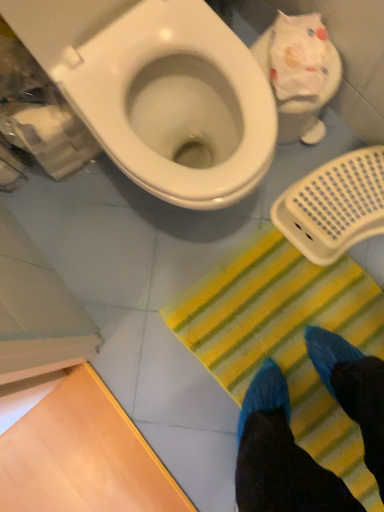
What do you see at coordinates (299, 73) in the screenshot? I see `white plastic toilet at upper right, which is counted as the second toilet, starting from the left` at bounding box center [299, 73].

At what (x,y) coordinates should I click in order to perform the action: click on yellow striped mat at lower center. Please return your answer as a coordinate pair (x, y). The width and height of the screenshot is (384, 512). Looking at the image, I should click on click(x=279, y=324).

Describe the element at coordinates (279, 324) in the screenshot. The image size is (384, 512). I see `yellow striped mat at lower center` at that location.

At what (x,y) coordinates should I click in order to perform the action: click on white plastic toilet at upper right, positioned as the first toilet in right-to-left order. Please return your answer as a coordinate pair (x, y). This screenshot has width=384, height=512. Looking at the image, I should click on (299, 73).

Considering the relative sizes of white plastic toilet at upper right, positioned as the first toilet in right-to-left order, and white glossy toilet at upper left, the first toilet viewed from the left, in the image provided, is white plastic toilet at upper right, positioned as the first toilet in right-to-left order, wider than white glossy toilet at upper left, the first toilet viewed from the left,?

In fact, white plastic toilet at upper right, positioned as the first toilet in right-to-left order, might be narrower than white glossy toilet at upper left, the first toilet viewed from the left.

Does white plastic toilet at upper right, which is counted as the second toilet, starting from the left, turn towards white glossy toilet at upper left, the 2th toilet from the right?

No.

Between white plastic toilet at upper right, which is counted as the second toilet, starting from the left, and white glossy toilet at upper left, the first toilet viewed from the left, which one has less height?

white plastic toilet at upper right, which is counted as the second toilet, starting from the left.

Does point (296, 26) come farther from viewer compared to point (170, 34)?

Yes, it is.

From a real-world perspective, is white glossy toilet at upper left, the first toilet viewed from the left, located higher than yellow striped mat at lower center?

Yes.

Considering the sizes of objects white glossy toilet at upper left, the first toilet viewed from the left, and yellow striped mat at lower center in the image provided, who is taller, white glossy toilet at upper left, the first toilet viewed from the left, or yellow striped mat at lower center?

Standing taller between the two is white glossy toilet at upper left, the first toilet viewed from the left.

Is white glossy toilet at upper left, the first toilet viewed from the left, placed right next to yellow striped mat at lower center?

No.

Is yellow striped mat at lower center positioned far away from white plastic toilet at upper right, positioned as the first toilet in right-to-left order?

No, yellow striped mat at lower center is not far from white plastic toilet at upper right, positioned as the first toilet in right-to-left order.

Can you confirm if yellow striped mat at lower center is thinner than white plastic toilet at upper right, which is counted as the second toilet, starting from the left?

A: Incorrect, the width of yellow striped mat at lower center is not less than that of white plastic toilet at upper right, which is counted as the second toilet, starting from the left.

Considering the positions of objects yellow striped mat at lower center and white plastic toilet at upper right, which is counted as the second toilet, starting from the left, in the image provided, who is more to the left, yellow striped mat at lower center or white plastic toilet at upper right, which is counted as the second toilet, starting from the left,?

white plastic toilet at upper right, which is counted as the second toilet, starting from the left.

Could you tell me if yellow striped mat at lower center is facing white plastic toilet at upper right, positioned as the first toilet in right-to-left order?

No, yellow striped mat at lower center is not aimed at white plastic toilet at upper right, positioned as the first toilet in right-to-left order.

Is white plastic toilet at upper right, positioned as the first toilet in right-to-left order, to the left or to the right of yellow striped mat at lower center in the image?

white plastic toilet at upper right, positioned as the first toilet in right-to-left order, is to the left of yellow striped mat at lower center.

Based on the photo, is white plastic toilet at upper right, positioned as the first toilet in right-to-left order, oriented away from yellow striped mat at lower center?

No, white plastic toilet at upper right, positioned as the first toilet in right-to-left order, is not facing the opposite direction of yellow striped mat at lower center.

Does point (282, 85) come closer to viewer compared to point (376, 305)?

Yes, it is in front of point (376, 305).

From the image's perspective, between white plastic toilet at upper right, positioned as the first toilet in right-to-left order, and yellow striped mat at lower center, who is located below?

yellow striped mat at lower center.

From the image's perspective, is white glossy toilet at upper left, the 2th toilet from the right, over white plastic toilet at upper right, which is counted as the second toilet, starting from the left?

No, from the image's perspective, white glossy toilet at upper left, the 2th toilet from the right, is not over white plastic toilet at upper right, which is counted as the second toilet, starting from the left.

Is point (145, 58) farther from camera compared to point (265, 61)?

No, it is in front of (265, 61).

Considering the relative sizes of white glossy toilet at upper left, the 2th toilet from the right, and white plastic toilet at upper right, positioned as the first toilet in right-to-left order, in the image provided, is white glossy toilet at upper left, the 2th toilet from the right, shorter than white plastic toilet at upper right, positioned as the first toilet in right-to-left order,?

No.

In terms of width, does yellow striped mat at lower center look wider or thinner when compared to white glossy toilet at upper left, the 2th toilet from the right?

Clearly, yellow striped mat at lower center has more width compared to white glossy toilet at upper left, the 2th toilet from the right.

Is yellow striped mat at lower center beside white glossy toilet at upper left, the 2th toilet from the right?

No, yellow striped mat at lower center is not in contact with white glossy toilet at upper left, the 2th toilet from the right.

Can we say yellow striped mat at lower center lies outside white glossy toilet at upper left, the 2th toilet from the right?

Yes, yellow striped mat at lower center is outside of white glossy toilet at upper left, the 2th toilet from the right.

This screenshot has width=384, height=512. Find the location of `toilet in front of the white plastic toilet at upper right, which is counted as the second toilet, starting from the left`. toilet in front of the white plastic toilet at upper right, which is counted as the second toilet, starting from the left is located at coordinates (158, 90).

Locate an element on the screen. This screenshot has height=512, width=384. toilet that is the 1st one when counting upward from the yellow striped mat at lower center (from the image's perspective) is located at coordinates (158, 90).

From the picture: Looking at the image, which one is located further to white plastic toilet at upper right, which is counted as the second toilet, starting from the left, yellow striped mat at lower center or white glossy toilet at upper left, the first toilet viewed from the left?

Among the two, yellow striped mat at lower center is located further to white plastic toilet at upper right, which is counted as the second toilet, starting from the left.

From the image, which object appears to be farther from white glossy toilet at upper left, the first toilet viewed from the left, white plastic toilet at upper right, which is counted as the second toilet, starting from the left, or yellow striped mat at lower center?

yellow striped mat at lower center is further to white glossy toilet at upper left, the first toilet viewed from the left.

Considering their positions, is white glossy toilet at upper left, the first toilet viewed from the left, positioned further to white plastic toilet at upper right, which is counted as the second toilet, starting from the left, than yellow striped mat at lower center?

yellow striped mat at lower center lies further to white plastic toilet at upper right, which is counted as the second toilet, starting from the left, than the other object.

Consider the image. Estimate the real-world distances between objects in this image. Which object is further from yellow striped mat at lower center, white glossy toilet at upper left, the 2th toilet from the right, or white plastic toilet at upper right, which is counted as the second toilet, starting from the left?

Among the two, white glossy toilet at upper left, the 2th toilet from the right, is located further to yellow striped mat at lower center.

Based on their spatial positions, is yellow striped mat at lower center or white plastic toilet at upper right, which is counted as the second toilet, starting from the left, further from white glossy toilet at upper left, the 2th toilet from the right?

yellow striped mat at lower center is positioned further to the anchor white glossy toilet at upper left, the 2th toilet from the right.

When comparing their distances from yellow striped mat at lower center, does white plastic toilet at upper right, positioned as the first toilet in right-to-left order, or white glossy toilet at upper left, the first toilet viewed from the left, seem closer?

The object closer to yellow striped mat at lower center is white plastic toilet at upper right, positioned as the first toilet in right-to-left order.

Locate an element on the screen. The height and width of the screenshot is (512, 384). toilet between white plastic toilet at upper right, positioned as the first toilet in right-to-left order, and yellow striped mat at lower center vertically is located at coordinates (158, 90).